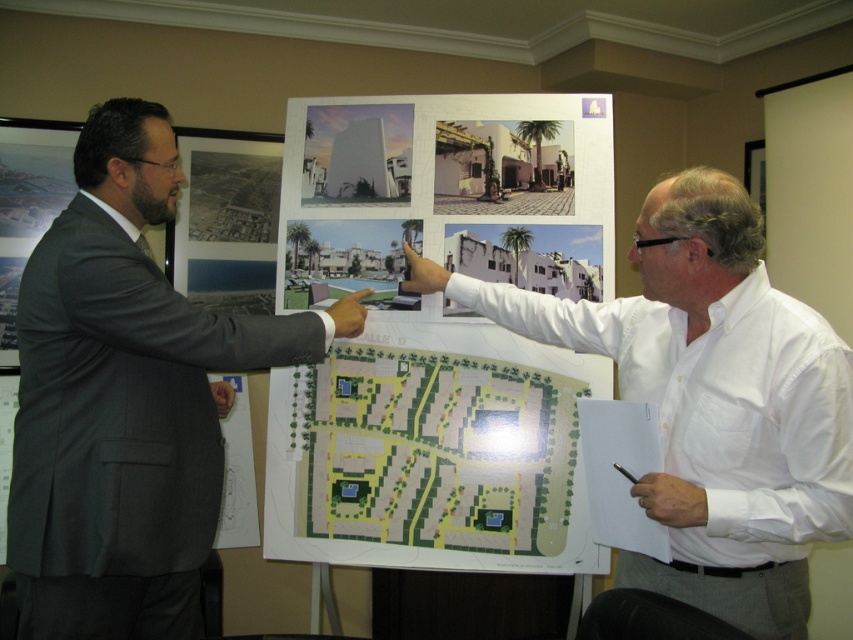
Is dark gray suit at left smaller than white shirt at upper right?

Yes, dark gray suit at left is smaller than white shirt at upper right.

Does point (161, 198) lie in front of point (518, 314)?

Yes, point (161, 198) is closer to viewer.

Between point (171, 321) and point (682, 563), which one is positioned behind?

The point (171, 321) is more distant.

At what (x,y) coordinates should I click in order to perform the action: click on dark gray suit at left. Please return your answer as a coordinate pair (x, y). Looking at the image, I should click on (126, 400).

Does point (755, 481) come closer to viewer compared to point (427, 476)?

Yes, point (755, 481) is in front of point (427, 476).

Is white shirt at upper right smaller than green paper map at center?

Actually, white shirt at upper right might be larger than green paper map at center.

This screenshot has width=853, height=640. In order to click on white shirt at upper right in this screenshot , I will do `click(711, 401)`.

Is dark gray suit at left positioned behind green paper map at center?

No.

Which is behind, point (308, 356) or point (467, 397)?

Positioned behind is point (467, 397).

Who is more distant from viewer, (154, 468) or (419, 474)?

Point (419, 474)

Find the location of a particular element. This screenshot has width=853, height=640. dark gray suit at left is located at coordinates (126, 400).